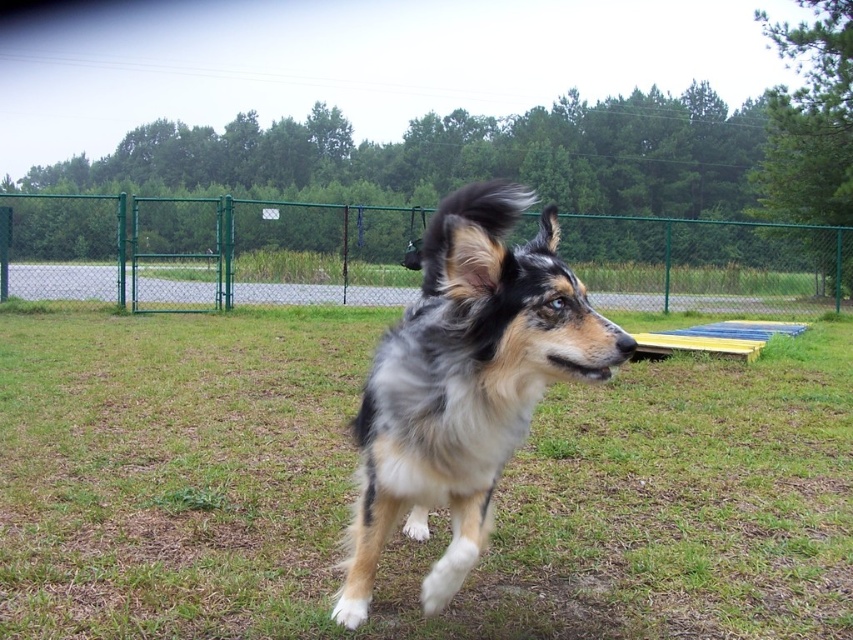
Is point (160, 236) behind point (444, 598)?

Yes.

This screenshot has width=853, height=640. What do you see at coordinates (202, 250) in the screenshot?
I see `green chain-link fence at center` at bounding box center [202, 250].

I want to click on green chain-link fence at center, so click(x=202, y=250).

Who is more forward, [15,314] or [474,256]?

Point [474,256] is in front.

Can you confirm if fuzzy fur dog at center is positioned below shaggy fur dog at center?

Correct, fuzzy fur dog at center is located below shaggy fur dog at center.

Locate an element on the screen. This screenshot has width=853, height=640. fuzzy fur dog at center is located at coordinates point(430,515).

Which of these two, fuzzy fur dog at center or green chain-link fence at center, stands shorter?

fuzzy fur dog at center is shorter.

Is point (850, 618) farther from camera compared to point (223, 225)?

No, (850, 618) is closer to viewer.

Locate an element on the screen. fuzzy fur dog at center is located at coordinates (430, 515).